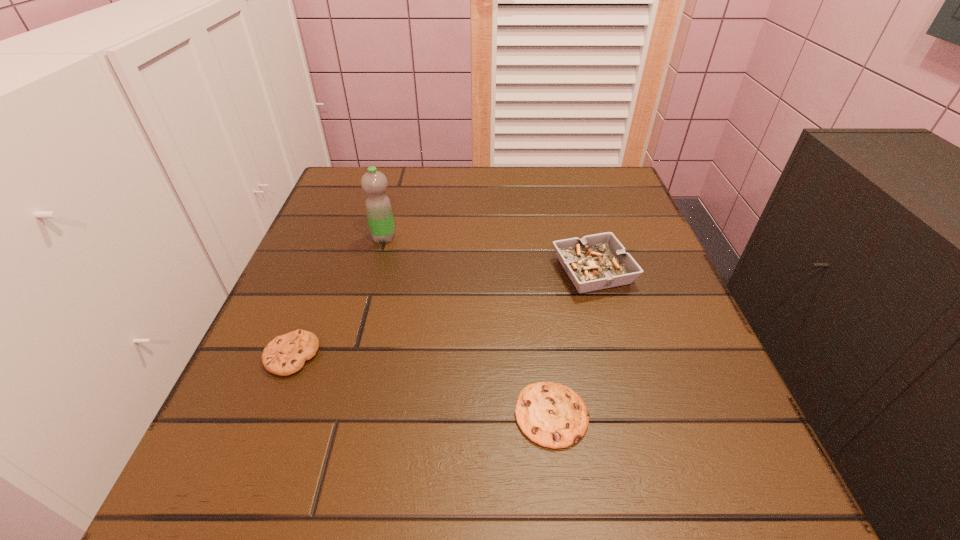
The height and width of the screenshot is (540, 960). I want to click on vacant space at the near right corner of the desktop, so click(717, 469).

What are the coordinates of `vacant space that is in between the farthest object and the farther cookie` in the screenshot? It's located at (338, 296).

At what (x,y) coordinates should I click in order to perform the action: click on vacant space that is in between the third tallest object and the nearest object. Please return your answer as a coordinate pair (x, y). Looking at the image, I should click on (421, 386).

In order to click on free space between the second nearest object and the nearest object in this screenshot , I will do `click(421, 386)`.

Locate an element on the screen. Image resolution: width=960 pixels, height=540 pixels. empty space that is in between the second nearest object and the second tallest object is located at coordinates (443, 313).

The width and height of the screenshot is (960, 540). In order to click on vacant space in between the nearest object and the ashtray in this screenshot , I will do `click(572, 343)`.

In order to click on empty space between the second object from left to right and the ashtray in this screenshot , I will do `click(489, 254)`.

The image size is (960, 540). I want to click on vacant point located between the third shortest object and the farthest object, so click(489, 254).

The image size is (960, 540). What are the coordinates of `empty location between the shortest object and the tallest object` in the screenshot? It's located at (468, 326).

Locate an element on the screen. This screenshot has height=540, width=960. vacant area that lies between the shortest object and the third tallest object is located at coordinates (421, 386).